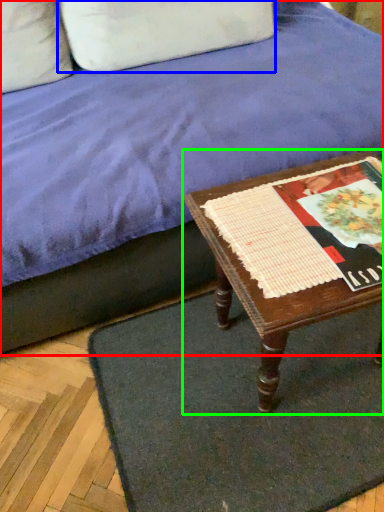
Question: Which is nearer to the studio couch (highlighted by a red box)? pillow (highlighted by a blue box) or table (highlighted by a green box).

Choices:
 (A) pillow
 (B) table

Answer: (B)